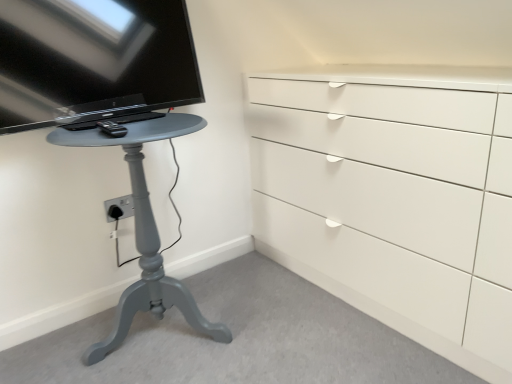
Describe the element at coordinates (144, 232) in the screenshot. This screenshot has height=384, width=512. I see `matte gray table at left` at that location.

Locate an element on the screen. matte gray table at left is located at coordinates (144, 232).

Where is `black plastic remote control at left`? The height and width of the screenshot is (384, 512). black plastic remote control at left is located at coordinates (112, 128).

Locate an element on the screen. This screenshot has height=384, width=512. furniture that appears below the black plastic remote control at left (from the image's perspective) is located at coordinates (144, 232).

Measure the distance from matte gray table at left to black plastic remote control at left.

matte gray table at left is 15.19 inches from black plastic remote control at left.

Is matte gray table at left not close to black plastic remote control at left?

They are positioned close to each other.

Which object is positioned more to the left, matte gray table at left or black plastic remote control at left?

Positioned to the left is black plastic remote control at left.

Can you confirm if black glossy tv at upper left is wider than black plastic remote control at left?

Correct, the width of black glossy tv at upper left exceeds that of black plastic remote control at left.

Which object is closer to the camera, black glossy tv at upper left or black plastic remote control at left?

black glossy tv at upper left.

Looking at this image, from the image's perspective, is black glossy tv at upper left located above or below black plastic remote control at left?

Clearly, from the image's perspective, black glossy tv at upper left is above black plastic remote control at left.

Considering the positions of points (21, 115) and (122, 132), is point (21, 115) closer to camera compared to point (122, 132)?

No, it is behind (122, 132).

Considering the sizes of objects matte gray table at left and black glossy tv at upper left in the image provided, who is wider, matte gray table at left or black glossy tv at upper left?

matte gray table at left.

Does matte gray table at left lie behind black glossy tv at upper left?

No, it is in front of black glossy tv at upper left.

From a real-world perspective, who is located higher, matte gray table at left or black glossy tv at upper left?

black glossy tv at upper left is physically above.

In terms of size, does matte gray table at left appear bigger or smaller than black glossy tv at upper left?

Considering their sizes, matte gray table at left takes up more space than black glossy tv at upper left.

Is the depth of black plastic remote control at left greater than that of matte gray table at left?

Yes, black plastic remote control at left is further from the viewer.

Considering the relative positions of black plastic remote control at left and matte gray table at left in the image provided, is black plastic remote control at left to the right of matte gray table at left from the viewer's perspective?

No.

From the image's perspective, between black plastic remote control at left and matte gray table at left, who is located below?

matte gray table at left is shown below in the image.

Who is bigger, black plastic remote control at left or black glossy tv at upper left?

black glossy tv at upper left is bigger.

Is black plastic remote control at left positioned with its back to black glossy tv at upper left?

Correct, black plastic remote control at left is looking away from black glossy tv at upper left.

From a real-world perspective, is black plastic remote control at left positioned over black glossy tv at upper left based on gravity?

No, from a real-world perspective, black plastic remote control at left is not above black glossy tv at upper left.

Is point (108, 128) in front of point (15, 96)?

That is True.

From a real-world perspective, who is located lower, black glossy tv at upper left or matte gray table at left?

In real-world perspective, matte gray table at left is lower.

Would you say black glossy tv at upper left is inside or outside matte gray table at left?

black glossy tv at upper left is located beyond the bounds of matte gray table at left.

Are black glossy tv at upper left and matte gray table at left located far from each other?

No.

What's the angular difference between black glossy tv at upper left and matte gray table at left's facing directions?

0.119 degrees separate the facing orientations of black glossy tv at upper left and matte gray table at left.

The height and width of the screenshot is (384, 512). What are the coordinates of `furniture that is in front of the black plastic remote control at left` in the screenshot? It's located at (144, 232).

Locate an element on the screen. Image resolution: width=512 pixels, height=384 pixels. equipment that is below the black glossy tv at upper left (from the image's perspective) is located at coordinates (112, 128).

When comparing their distances from black glossy tv at upper left, does matte gray table at left or black plastic remote control at left seem closer?

black plastic remote control at left is positioned closer to the anchor black glossy tv at upper left.

When comparing their distances from black plastic remote control at left, does black glossy tv at upper left or matte gray table at left seem further?

matte gray table at left is positioned further to the anchor black plastic remote control at left.

Looking at the image, which one is located further to matte gray table at left, black plastic remote control at left or black glossy tv at upper left?

Based on the image, black plastic remote control at left appears to be further to matte gray table at left.

Which object lies nearer to the anchor point black plastic remote control at left, matte gray table at left or black glossy tv at upper left?

The object closer to black plastic remote control at left is black glossy tv at upper left.

From the image, which object appears to be nearer to matte gray table at left, black glossy tv at upper left or black plastic remote control at left?

The object closer to matte gray table at left is black glossy tv at upper left.

Considering their positions, is black plastic remote control at left positioned further to black glossy tv at upper left than matte gray table at left?

matte gray table at left is further to black glossy tv at upper left.

Find the location of `equipment that lies between black glossy tv at upper left and matte gray table at left from top to bottom`. equipment that lies between black glossy tv at upper left and matte gray table at left from top to bottom is located at coordinates (112, 128).